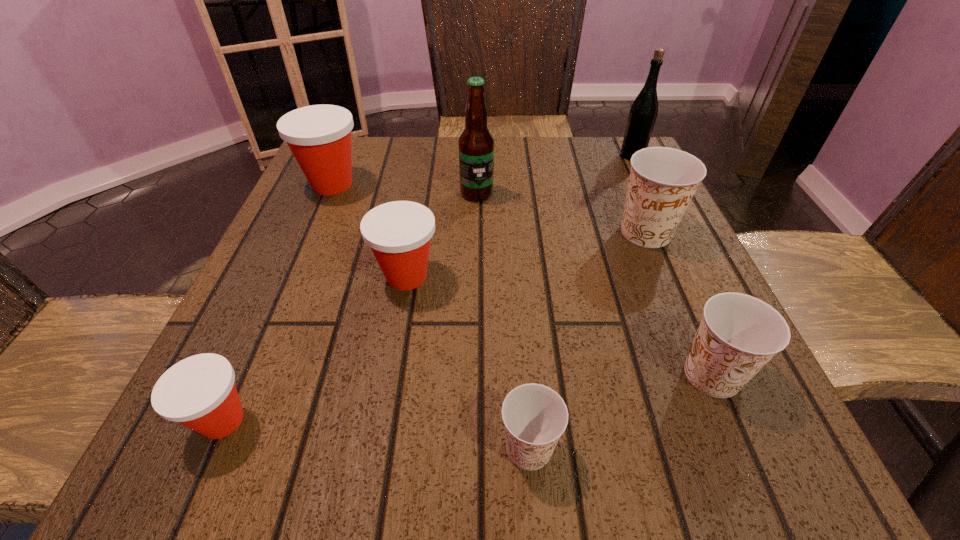
Locate which object is the closest to the fifth farthest object. Please provide its 2D coordinates. Your answer should be formatted as a tuple, i.e. [(x, y)], where the tuple contains the x and y coordinates of a point satisfying the conditions above.

[(476, 144)]

At what (x,y) coordinates should I click in order to perform the action: click on object that is the third closest to the second biggest orange Dixie cup. Please return your answer as a coordinate pair (x, y). Looking at the image, I should click on (399, 233).

Select which Dixie cup is the third closest to the third object from left to right. Please provide its 2D coordinates. Your answer should be formatted as a tuple, i.e. [(x, y)], where the tuple contains the x and y coordinates of a point satisfying the conditions above.

[(535, 416)]

Locate an element on the screen. The height and width of the screenshot is (540, 960). the second closest Dixie cup relative to the second biggest orange Dixie cup is located at coordinates (663, 180).

Locate an element on the screen. This screenshot has height=540, width=960. red-orange Dixie cup that is the closest to the biggest orange Dixie cup is located at coordinates (399, 233).

Locate an element on the screen. Image resolution: width=960 pixels, height=540 pixels. the second closest red-orange Dixie cup to the fourth farthest object is located at coordinates click(319, 136).

At what (x,y) coordinates should I click in order to perform the action: click on orange Dixie cup that is the second nearest to the fifth farthest object. Please return your answer as a coordinate pair (x, y). Image resolution: width=960 pixels, height=540 pixels. Looking at the image, I should click on (663, 180).

At what (x,y) coordinates should I click in order to perform the action: click on the third closest orange Dixie cup to the green beer bottle. Please return your answer as a coordinate pair (x, y). The height and width of the screenshot is (540, 960). Looking at the image, I should click on (535, 416).

Locate an element on the screen. vacant area that satisfies the following two spatial constraints: 1. on the back side of the fourth nearest object; 2. on the right side of the nearest red-orange Dixie cup is located at coordinates (286, 276).

You are a GUI agent. You are given a task and a screenshot of the screen. Output one action in this format:
    pyautogui.click(x=<x>, y=<y>)
    Task: Click on the free spot that satisfies the following two spatial constraints: 1. on the front side of the third farthest Dixie cup; 2. on the left side of the second farthest orange Dixie cup
    This screenshot has height=540, width=960.
    Given the screenshot: What is the action you would take?
    pyautogui.click(x=390, y=375)